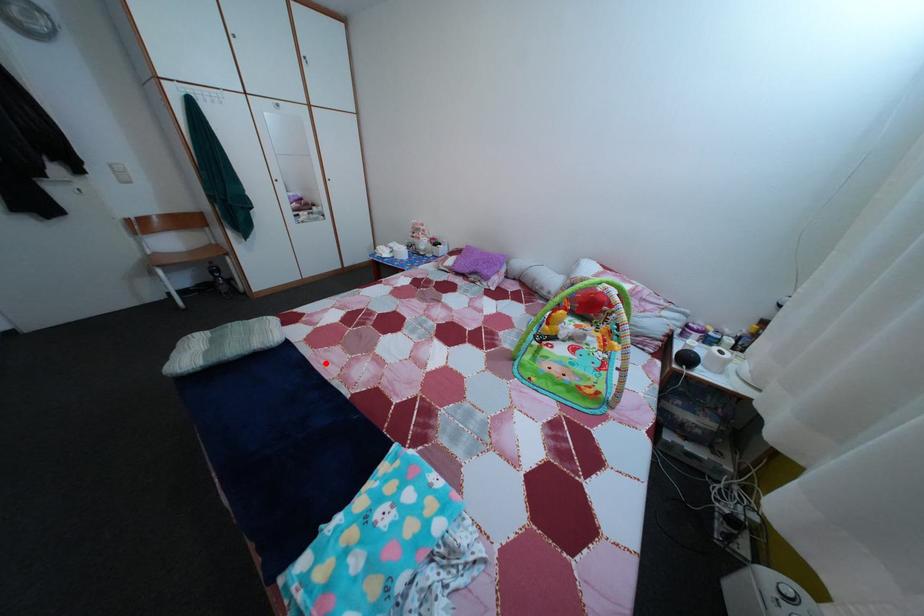
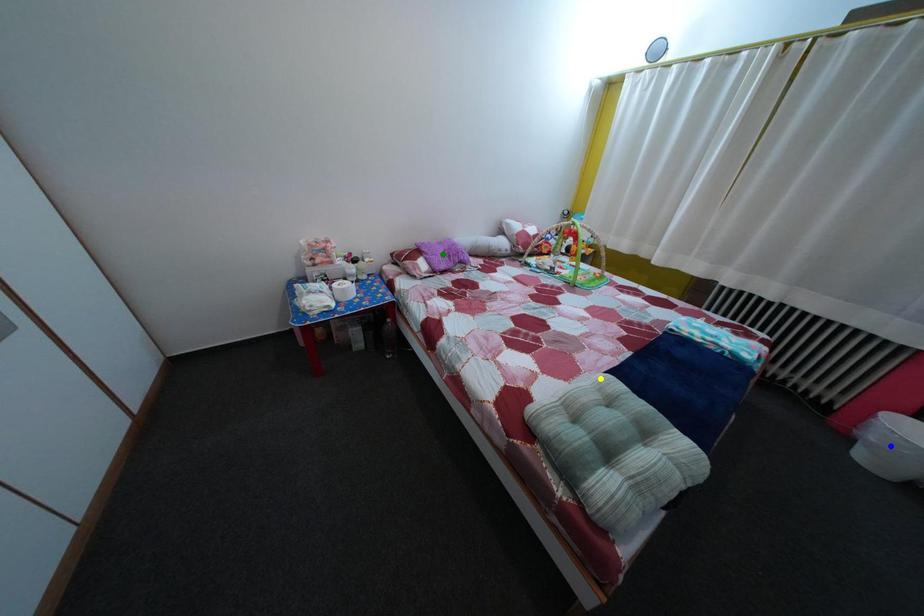
Question: I am providing you with two images of the same scene from different viewpoints. A red point is marked on the first image. You are given multiple points on the second image. Which point in image 2 is actually the same real-world point as the red point in image 1?

Choices:
 (A) green point
 (B) yellow point
 (C) blue point

Answer: (B)